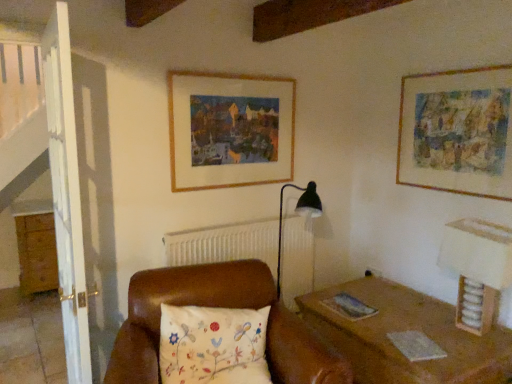
Question: Is wooden frame at upper center, positioned as the first picture frame in left-to-right order, smaller than wooden dresser at left?

Choices:
 (A) yes
 (B) no

Answer: (A)

Question: Is wooden frame at upper center, placed as the second picture frame when sorted from right to left, facing away from wooden dresser at left?

Choices:
 (A) no
 (B) yes

Answer: (A)

Question: From the image's perspective, is wooden frame at upper center, positioned as the first picture frame in left-to-right order, on wooden dresser at left?

Choices:
 (A) no
 (B) yes

Answer: (B)

Question: From a real-world perspective, is wooden frame at upper center, positioned as the first picture frame in left-to-right order, below wooden dresser at left?

Choices:
 (A) no
 (B) yes

Answer: (A)

Question: From a real-world perspective, is wooden frame at upper center, placed as the second picture frame when sorted from right to left, positioned over wooden dresser at left based on gravity?

Choices:
 (A) no
 (B) yes

Answer: (B)

Question: Considering the relative sizes of wooden frame at upper center, placed as the second picture frame when sorted from right to left, and wooden dresser at left in the image provided, is wooden frame at upper center, placed as the second picture frame when sorted from right to left, wider than wooden dresser at left?

Choices:
 (A) no
 (B) yes

Answer: (A)

Question: Considering the relative positions of wooden table lamp at right and wooden frame at upper center, positioned as the first picture frame in left-to-right order, in the image provided, is wooden table lamp at right to the left of wooden frame at upper center, positioned as the first picture frame in left-to-right order, from the viewer's perspective?

Choices:
 (A) no
 (B) yes

Answer: (A)

Question: Does wooden table lamp at right turn towards wooden frame at upper center, placed as the second picture frame when sorted from right to left?

Choices:
 (A) yes
 (B) no

Answer: (B)

Question: Does wooden table lamp at right appear on the right side of wooden frame at upper center, positioned as the first picture frame in left-to-right order?

Choices:
 (A) no
 (B) yes

Answer: (B)

Question: Is wooden table lamp at right bigger than wooden frame at upper center, placed as the second picture frame when sorted from right to left?

Choices:
 (A) yes
 (B) no

Answer: (A)

Question: Is wooden table lamp at right wider than wooden frame at upper center, positioned as the first picture frame in left-to-right order?

Choices:
 (A) yes
 (B) no

Answer: (A)

Question: Would you say wooden table lamp at right is outside wooden frame at upper center, positioned as the first picture frame in left-to-right order?

Choices:
 (A) no
 (B) yes

Answer: (B)

Question: Does wooden frame at upper center, placed as the second picture frame when sorted from right to left, have a smaller size compared to floral-patterned fabric pillow at center?

Choices:
 (A) yes
 (B) no

Answer: (A)